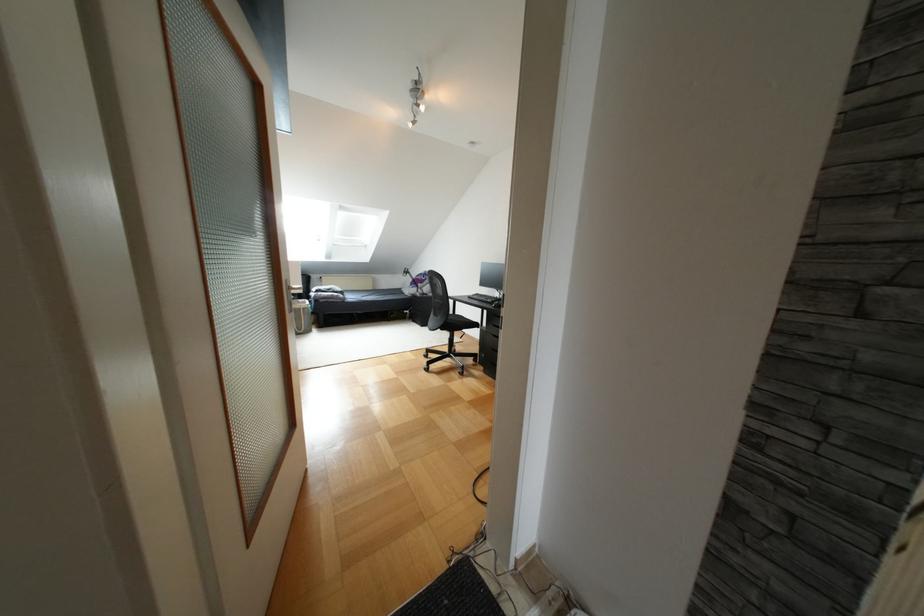
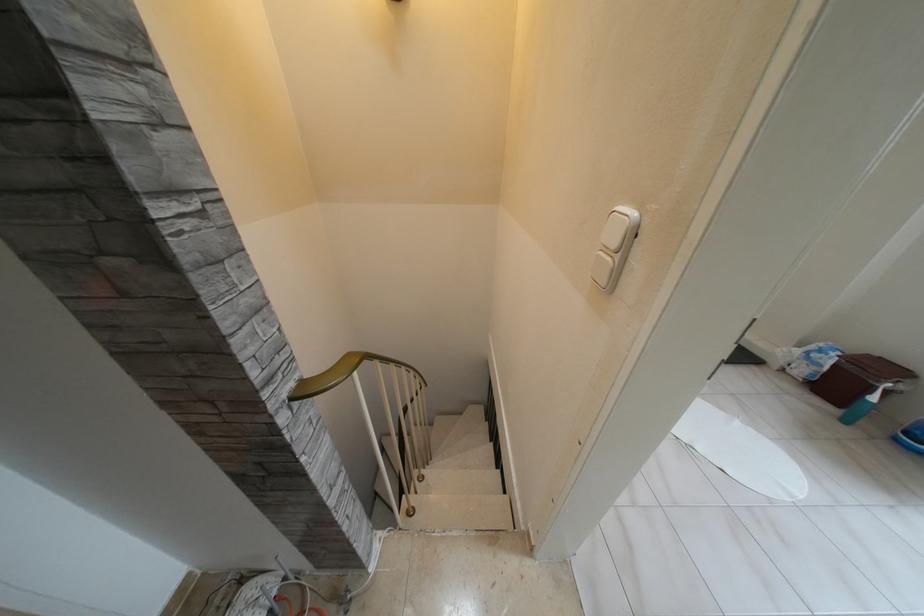
Based on the continuous images, in which direction is the camera rotating?

The camera's rotation is toward right-down.